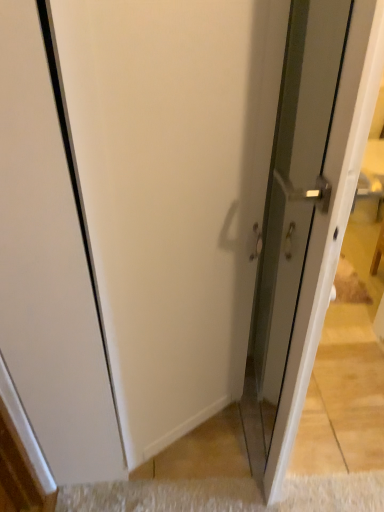
This screenshot has width=384, height=512. I want to click on white carpet at lower center, so click(x=227, y=495).

What do you see at coordinates (227, 495) in the screenshot? The height and width of the screenshot is (512, 384). I see `white carpet at lower center` at bounding box center [227, 495].

In order to face white carpet at lower center, should I rotate leftwards or rightwards?

Turn right approximately 4.099 degrees to face it.

What do you see at coordinates (291, 208) in the screenshot?
I see `clear glass door at right` at bounding box center [291, 208].

Where is `clear glass door at right`? Image resolution: width=384 pixels, height=512 pixels. clear glass door at right is located at coordinates (291, 208).

Locate an element on the screen. white carpet at lower center is located at coordinates click(x=227, y=495).

In the image, is white carpet at lower center on the left side or the right side of clear glass door at right?

white carpet at lower center is positioned on clear glass door at right's left side.

Which is in front, white carpet at lower center or clear glass door at right?

clear glass door at right.

Between point (115, 511) and point (260, 270), which one is positioned behind?

Positioned behind is point (115, 511).

From the image's perspective, is white carpet at lower center under clear glass door at right?

Yes.

From a real-world perspective, is white carpet at lower center located higher than clear glass door at right?

No, from a real-world perspective, white carpet at lower center is not above clear glass door at right.

Considering the relative sizes of white carpet at lower center and clear glass door at right in the image provided, is white carpet at lower center thinner than clear glass door at right?

Indeed, white carpet at lower center has a lesser width compared to clear glass door at right.

Does white carpet at lower center have a lesser height compared to clear glass door at right?

Indeed, white carpet at lower center has a lesser height compared to clear glass door at right.

Is white carpet at lower center bigger than clear glass door at right?

No.

Is white carpet at lower center surrounding clear glass door at right?

No.

Is white carpet at lower center far from clear glass door at right?

That's not correct — white carpet at lower center is a little close to clear glass door at right.

Is white carpet at lower center turned away from clear glass door at right?

white carpet at lower center is not turned away from clear glass door at right.

This screenshot has height=512, width=384. I want to click on doormat on the left of clear glass door at right, so click(x=227, y=495).

Looking at this image, considering the relative positions of clear glass door at right and white carpet at lower center in the image provided, is clear glass door at right to the right of white carpet at lower center from the viewer's perspective?

Indeed, clear glass door at right is positioned on the right side of white carpet at lower center.

Which object is further away from the camera taking this photo, clear glass door at right or white carpet at lower center?

white carpet at lower center is behind.

Which is further, (282, 343) or (90, 492)?

The point (282, 343) is more distant.

From the image's perspective, is clear glass door at right positioned above or below white carpet at lower center?

From the image's perspective, clear glass door at right appears above white carpet at lower center.

From a real-world perspective, is clear glass door at right over white carpet at lower center?

Indeed, from a real-world perspective, clear glass door at right stands above white carpet at lower center.

From the picture: In terms of width, does clear glass door at right look wider or thinner when compared to white carpet at lower center?

clear glass door at right is wider than white carpet at lower center.

Can you confirm if clear glass door at right is shorter than white carpet at lower center?

In fact, clear glass door at right may be taller than white carpet at lower center.

Considering the relative sizes of clear glass door at right and white carpet at lower center in the image provided, is clear glass door at right smaller than white carpet at lower center?

Actually, clear glass door at right might be larger than white carpet at lower center.

Would you say clear glass door at right is inside or outside white carpet at lower center?

clear glass door at right is not inside white carpet at lower center, it's outside.

Is clear glass door at right not near white carpet at lower center?

No, clear glass door at right is not far from white carpet at lower center.

Is clear glass door at right facing away from white carpet at lower center?

Yes, white carpet at lower center is at the back of clear glass door at right.

Measure the distance between clear glass door at right and white carpet at lower center.

The distance of clear glass door at right from white carpet at lower center is 24.04 inches.

Identify the location of doormat below the clear glass door at right (from a real-world perspective). The height and width of the screenshot is (512, 384). (227, 495).

Locate an element on the screen. doormat behind the clear glass door at right is located at coordinates (227, 495).

In order to click on screen door above the white carpet at lower center (from a real-world perspective) in this screenshot , I will do `click(291, 208)`.